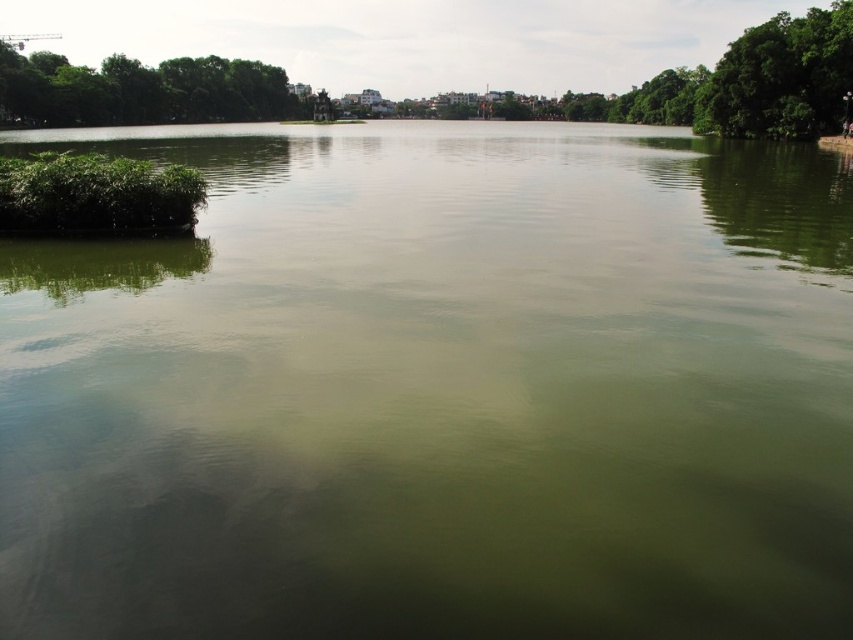
You are a landscape designer planning to add a new pathway near the green leafy tree at left and the green leafy algae at left. Since the pathway must be wider than the larger of the two, what is the minimum width required?

The green leafy tree at left is bigger than the green leafy algae at left. Therefore, the pathway must be wider than the green leafy tree at left. The minimum width required is just over the size of the green leafy tree at left.